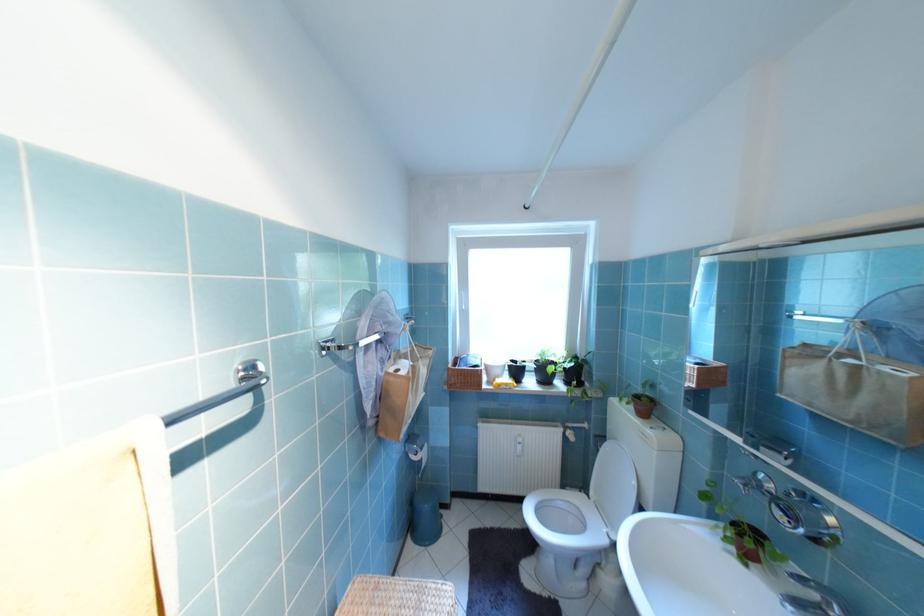
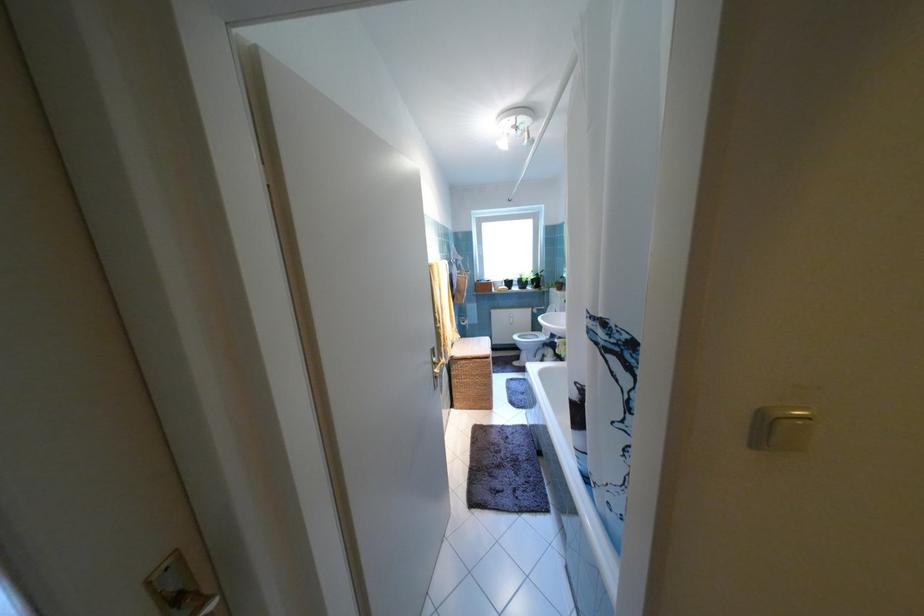
In the second image, find the point that corresponds to pixel 622 400 in the first image.

(561, 290)